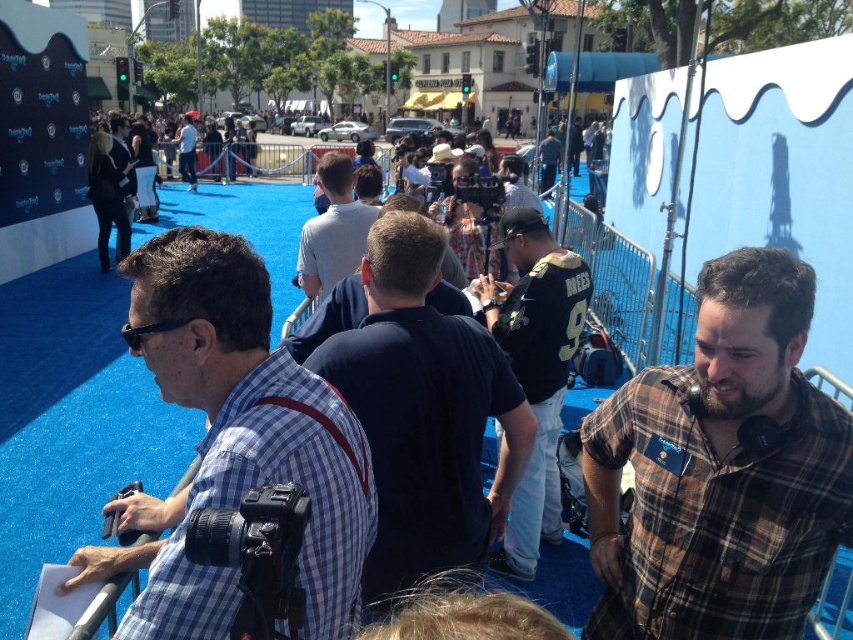
Question: Based on their relative distances, which object is farther from the light gray shirt at center?

Choices:
 (A) blue plaid shirt at center
 (B) black jersey at center
 (C) dark blue polo shirt at center
 (D) brown plaid shirt at center

Answer: (D)

Question: Is blue plaid shirt at center bigger than light gray shirt at center?

Choices:
 (A) yes
 (B) no

Answer: (A)

Question: Is brown plaid shirt at center below black jersey at center?

Choices:
 (A) yes
 (B) no

Answer: (A)

Question: Considering the real-world distances, which object is farthest from the light blue shirt at center?

Choices:
 (A) black jersey at center
 (B) light gray shirt at center
 (C) dark blue polo shirt at center
 (D) brown plaid shirt at center

Answer: (D)

Question: Can you confirm if blue plaid shirt at center is bigger than black jersey at center?

Choices:
 (A) yes
 (B) no

Answer: (B)

Question: Among these points, which one is nearest to the camera?

Choices:
 (A) (316, 625)
 (B) (341, 161)

Answer: (A)